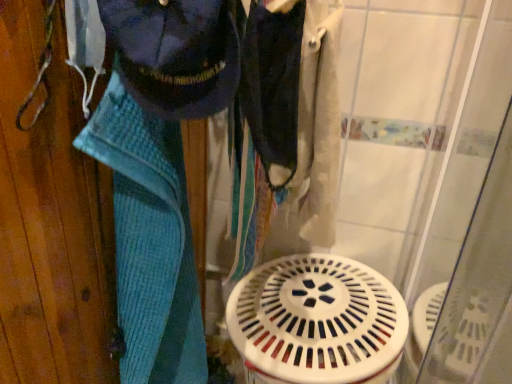
Question: In which direction should I rotate to look at dark blue fabric at center, which appears as the second clothing when viewed from the left?

Choices:
 (A) right
 (B) left

Answer: (A)

Question: Is white plastic water heater at center wider than navy blue fabric at upper left, acting as the second clothing starting from the right?

Choices:
 (A) no
 (B) yes

Answer: (B)

Question: From the image's perspective, is white plastic water heater at center on top of navy blue fabric at upper left, marked as the 1th clothing in a left-to-right arrangement?

Choices:
 (A) yes
 (B) no

Answer: (B)

Question: Can you confirm if white plastic water heater at center is bigger than navy blue fabric at upper left, acting as the second clothing starting from the right?

Choices:
 (A) yes
 (B) no

Answer: (A)

Question: Considering the relative positions of white plastic water heater at center and navy blue fabric at upper left, acting as the second clothing starting from the right, in the image provided, is white plastic water heater at center to the right of navy blue fabric at upper left, acting as the second clothing starting from the right, from the viewer's perspective?

Choices:
 (A) yes
 (B) no

Answer: (A)

Question: Does white plastic water heater at center have a lesser height compared to navy blue fabric at upper left, marked as the 1th clothing in a left-to-right arrangement?

Choices:
 (A) yes
 (B) no

Answer: (A)

Question: From the image's perspective, is white plastic water heater at center located beneath navy blue fabric at upper left, acting as the second clothing starting from the right?

Choices:
 (A) no
 (B) yes

Answer: (B)

Question: Does dark blue fabric at center, which appears as the second clothing when viewed from the left, have a lesser width compared to blue knitted towel at left?

Choices:
 (A) yes
 (B) no

Answer: (A)

Question: From the image's perspective, is dark blue fabric at center, the 1th clothing positioned from the right, on top of blue knitted towel at left?

Choices:
 (A) no
 (B) yes

Answer: (B)

Question: Considering the relative positions of dark blue fabric at center, which appears as the second clothing when viewed from the left, and blue knitted towel at left in the image provided, is dark blue fabric at center, which appears as the second clothing when viewed from the left, to the right of blue knitted towel at left from the viewer's perspective?

Choices:
 (A) yes
 (B) no

Answer: (A)

Question: Considering the relative sizes of dark blue fabric at center, which appears as the second clothing when viewed from the left, and blue knitted towel at left in the image provided, is dark blue fabric at center, which appears as the second clothing when viewed from the left, shorter than blue knitted towel at left?

Choices:
 (A) yes
 (B) no

Answer: (A)

Question: Is dark blue fabric at center, which appears as the second clothing when viewed from the left, positioned in front of blue knitted towel at left?

Choices:
 (A) no
 (B) yes

Answer: (B)

Question: Is dark blue fabric at center, the 1th clothing positioned from the right, facing towards blue knitted towel at left?

Choices:
 (A) yes
 (B) no

Answer: (B)

Question: From the image's perspective, is dark blue fabric at center, the 1th clothing positioned from the right, beneath navy blue fabric at upper left, acting as the second clothing starting from the right?

Choices:
 (A) yes
 (B) no

Answer: (A)